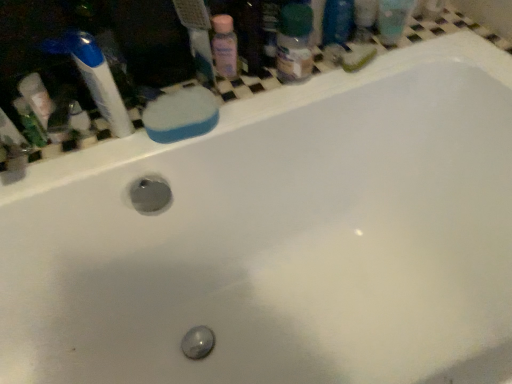
Question: Is pink plastic bottle at upper center thinner than translucent plastic bottle at upper right?

Choices:
 (A) yes
 (B) no

Answer: (A)

Question: Is pink plastic bottle at upper center bigger than translucent plastic bottle at upper right?

Choices:
 (A) no
 (B) yes

Answer: (A)

Question: From a real-world perspective, is pink plastic bottle at upper center physically below translucent plastic bottle at upper right?

Choices:
 (A) no
 (B) yes

Answer: (A)

Question: Can you confirm if pink plastic bottle at upper center is taller than translucent plastic bottle at upper right?

Choices:
 (A) no
 (B) yes

Answer: (A)

Question: Is pink plastic bottle at upper center positioned beyond the bounds of translucent plastic bottle at upper right?

Choices:
 (A) no
 (B) yes

Answer: (B)

Question: Is pink plastic bottle at upper center positioned in front of translucent plastic bottle at upper right?

Choices:
 (A) no
 (B) yes

Answer: (A)

Question: Is translucent plastic bottle at upper right smaller than blue sponge at upper left?

Choices:
 (A) no
 (B) yes

Answer: (B)

Question: From a real-world perspective, is translucent plastic bottle at upper right physically below blue sponge at upper left?

Choices:
 (A) yes
 (B) no

Answer: (B)

Question: From the image's perspective, is translucent plastic bottle at upper right beneath blue sponge at upper left?

Choices:
 (A) no
 (B) yes

Answer: (A)

Question: Does translucent plastic bottle at upper right have a greater width compared to blue sponge at upper left?

Choices:
 (A) no
 (B) yes

Answer: (A)

Question: Is translucent plastic bottle at upper right not within blue sponge at upper left?

Choices:
 (A) yes
 (B) no

Answer: (A)

Question: Can you confirm if translucent plastic bottle at upper right is taller than blue sponge at upper left?

Choices:
 (A) yes
 (B) no

Answer: (A)

Question: Would you say blue sponge at upper left is outside blue plastic toothbrush at upper left?

Choices:
 (A) no
 (B) yes

Answer: (B)